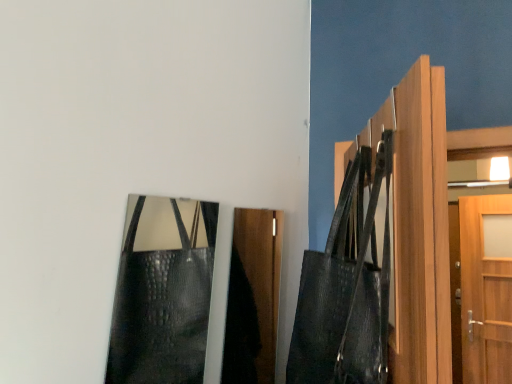
Question: Is leather textured shoulder bag at upper right positioned behind shiny black leather bag at lower left?

Choices:
 (A) yes
 (B) no

Answer: (B)

Question: Is leather textured shoulder bag at upper right closer to camera compared to shiny black leather bag at lower left?

Choices:
 (A) no
 (B) yes

Answer: (B)

Question: Is leather textured shoulder bag at upper right touching shiny black leather bag at lower left?

Choices:
 (A) no
 (B) yes

Answer: (A)

Question: Does leather textured shoulder bag at upper right have a smaller size compared to shiny black leather bag at lower left?

Choices:
 (A) yes
 (B) no

Answer: (B)

Question: Does leather textured shoulder bag at upper right turn towards shiny black leather bag at lower left?

Choices:
 (A) yes
 (B) no

Answer: (A)

Question: In terms of size, does light brown wood door at right appear bigger or smaller than leather textured shoulder bag at upper right?

Choices:
 (A) small
 (B) big

Answer: (A)

Question: Would you say light brown wood door at right is inside or outside leather textured shoulder bag at upper right?

Choices:
 (A) outside
 (B) inside

Answer: (A)

Question: Visually, is light brown wood door at right positioned to the left or to the right of leather textured shoulder bag at upper right?

Choices:
 (A) left
 (B) right

Answer: (B)

Question: From the image's perspective, is light brown wood door at right positioned above or below leather textured shoulder bag at upper right?

Choices:
 (A) below
 (B) above

Answer: (B)

Question: Considering the relative positions of light brown wood door at right and shiny black leather bag at lower left in the image provided, is light brown wood door at right to the left or to the right of shiny black leather bag at lower left?

Choices:
 (A) left
 (B) right

Answer: (B)

Question: Considering the positions of point (419, 59) and point (190, 327), is point (419, 59) closer or farther from the camera than point (190, 327)?

Choices:
 (A) farther
 (B) closer

Answer: (B)

Question: From the image's perspective, relative to shiny black leather bag at lower left, is light brown wood door at right above or below?

Choices:
 (A) above
 (B) below

Answer: (A)

Question: In terms of width, does light brown wood door at right look wider or thinner when compared to shiny black leather bag at lower left?

Choices:
 (A) wide
 (B) thin

Answer: (A)

Question: Is point (391, 160) positioned closer to the camera than point (407, 72)?

Choices:
 (A) closer
 (B) farther

Answer: (A)

Question: Considering the positions of leather textured shoulder bag at upper right and light brown wood door at right in the image, is leather textured shoulder bag at upper right taller or shorter than light brown wood door at right?

Choices:
 (A) short
 (B) tall

Answer: (A)